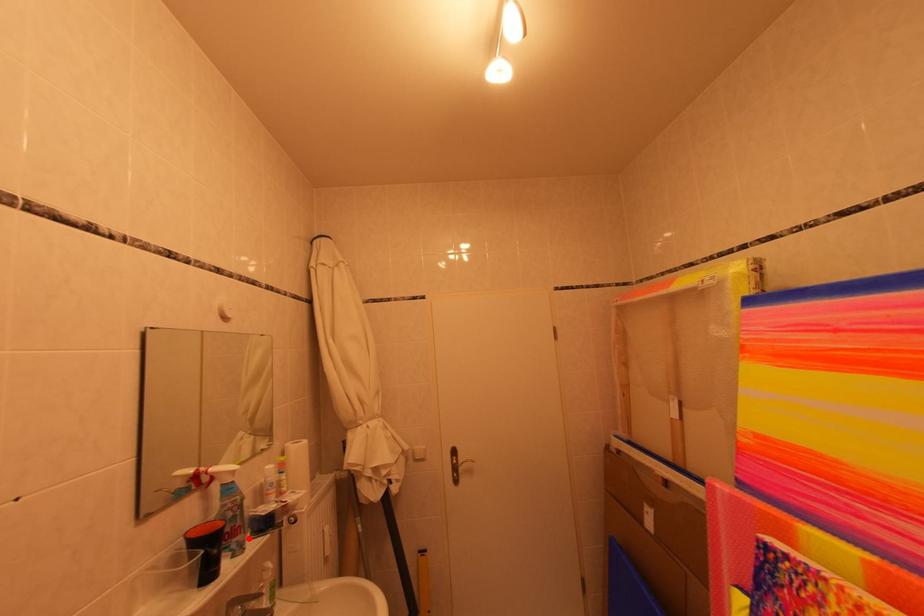
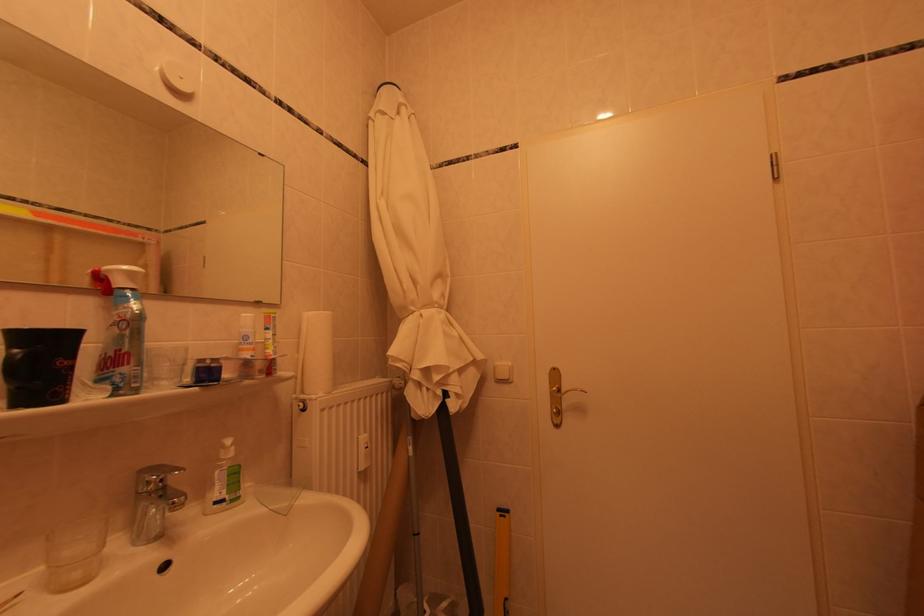
In the second image, find the point that corresponds to the highlighted location in the first image.

(138, 368)